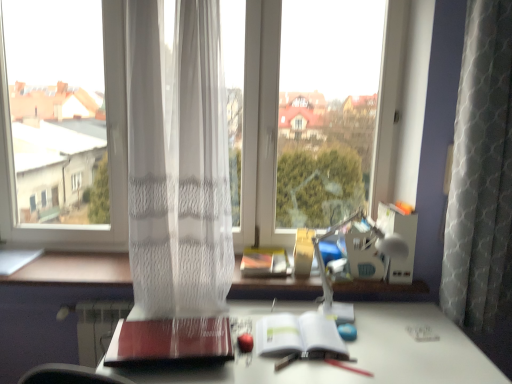
In order to click on vacant space to the right of white paper at center, which is counted as the 1th paperback book, starting from the right in this screenshot , I will do `click(377, 348)`.